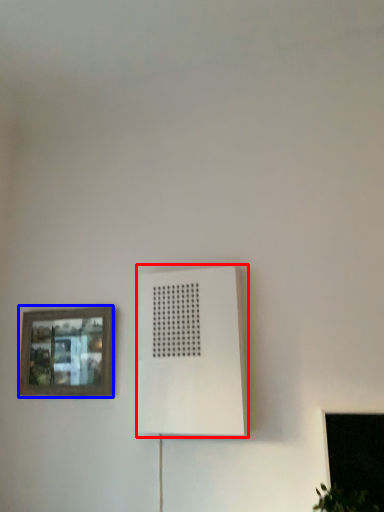
Question: Among these objects, which one is nearest to the camera, air conditioning (highlighted by a red box) or picture frame (highlighted by a blue box)?

Choices:
 (A) air conditioning
 (B) picture frame

Answer: (A)